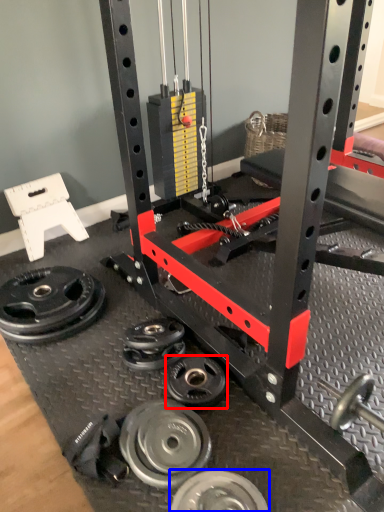
Question: Which object appears farthest to the camera in this image, wheel (highlighted by a red box) or wheel (highlighted by a blue box)?

Choices:
 (A) wheel
 (B) wheel

Answer: (A)